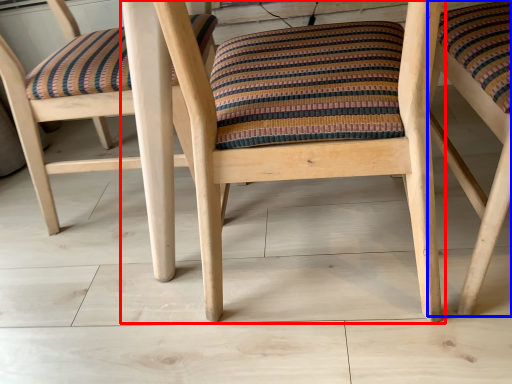
Question: Which point is further to the camera, chair (highlighted by a red box) or chair (highlighted by a blue box)?

Choices:
 (A) chair
 (B) chair

Answer: (B)